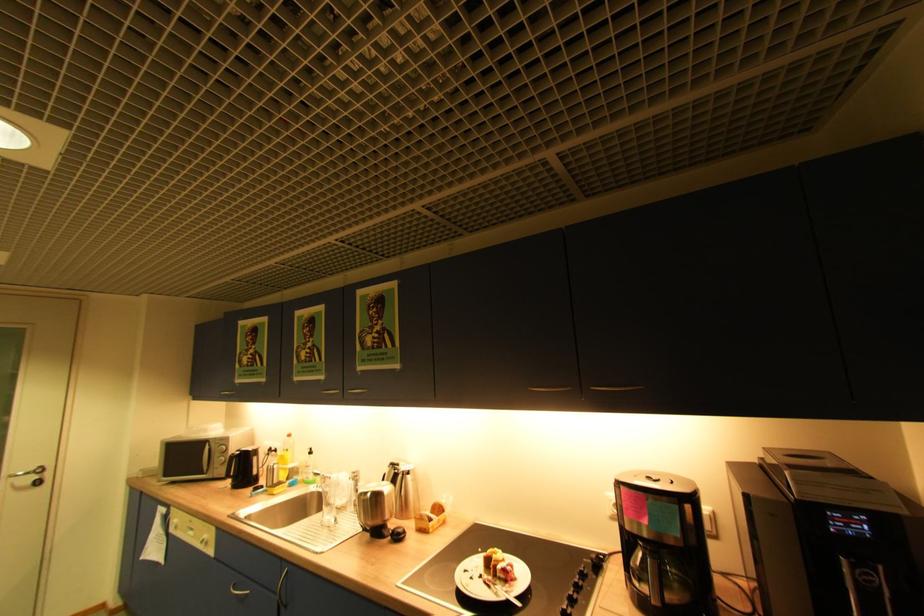
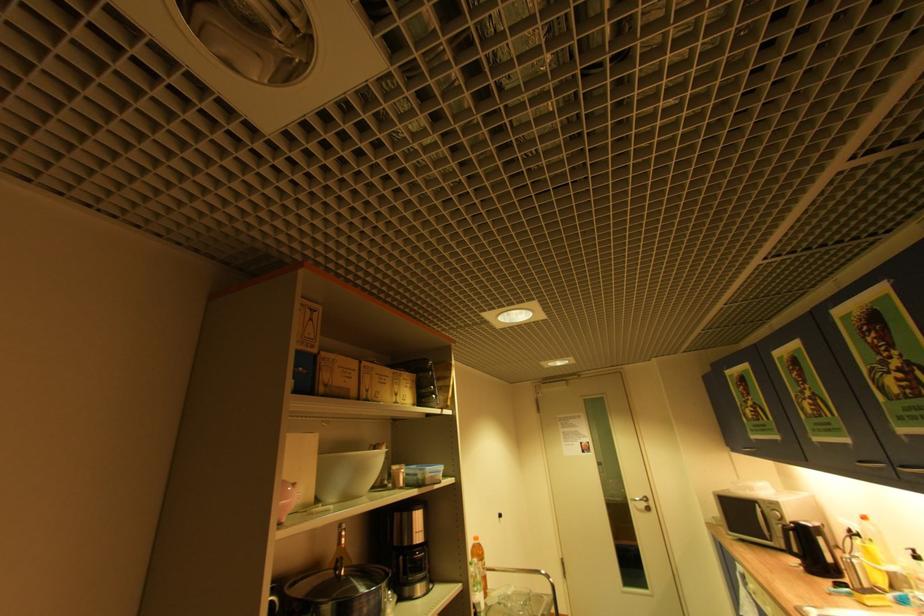
The point at (233, 477) is marked in the first image. Where is the corresponding point in the second image?

(796, 554)